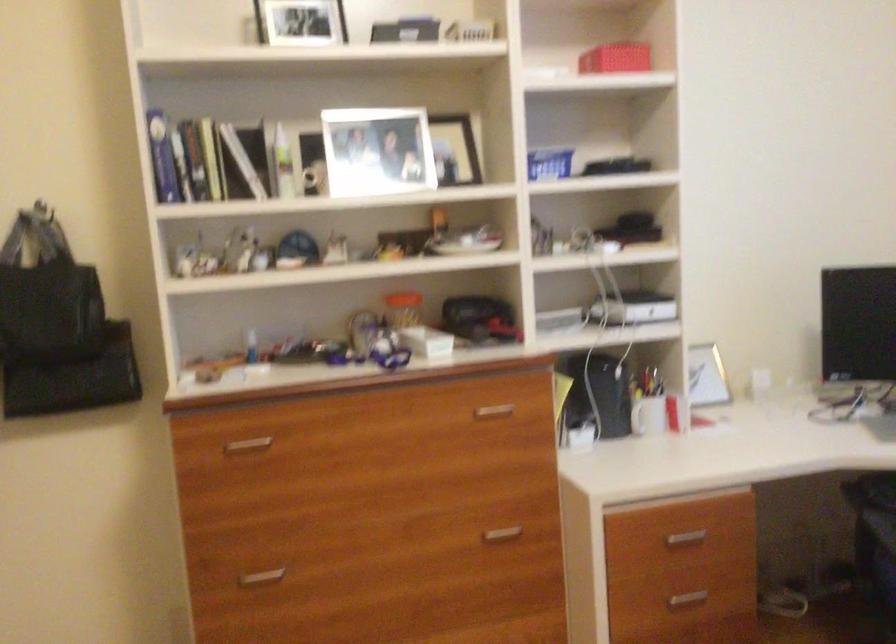
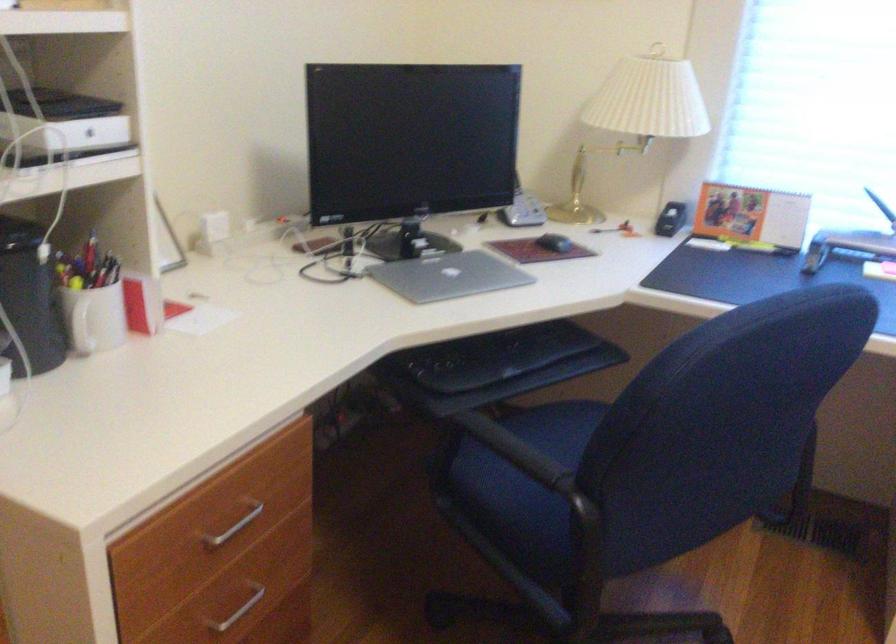
In the second image, find the point that corresponds to point (694, 542) in the first image.

(231, 527)